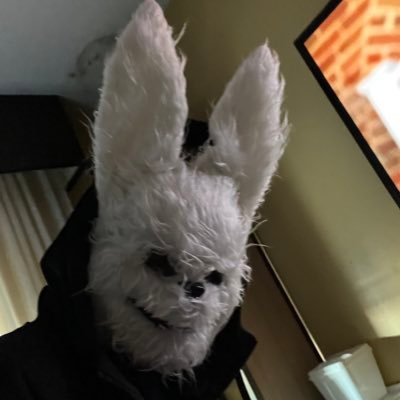
I want to click on curttain, so click(30, 242).